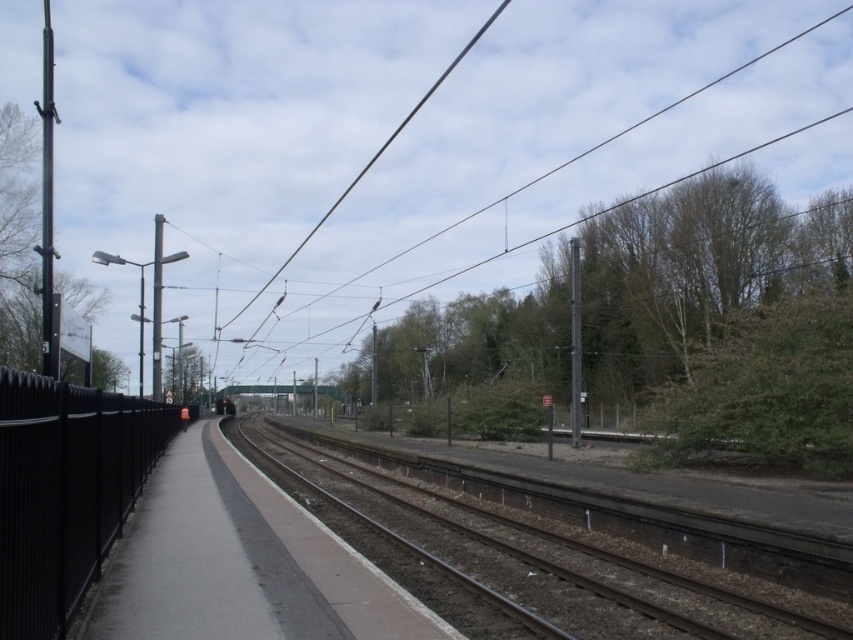
Is concrete platform at center smaller than black wire at upper center?

Indeed, concrete platform at center has a smaller size compared to black wire at upper center.

I want to click on concrete platform at center, so click(241, 563).

Who is more distant from viewer, (x=273, y=625) or (x=111, y=426)?

The point (x=111, y=426) is more distant.

Who is more forward, (x=215, y=579) or (x=71, y=518)?

Point (x=71, y=518) is more forward.

Find the location of `concrete platform at center`. concrete platform at center is located at coordinates [x=241, y=563].

Can you confirm if black metal fence at left is wider than black wire at upper center?

Incorrect, black metal fence at left's width does not surpass black wire at upper center's.

Consider the image. Does black metal fence at left have a lesser height compared to black wire at upper center?

Indeed, black metal fence at left has a lesser height compared to black wire at upper center.

Does point (122, 497) lie in front of point (699, 90)?

Yes.

At what (x,y) coordinates should I click in order to perform the action: click on black metal fence at left. Please return your answer as a coordinate pair (x, y). The height and width of the screenshot is (640, 853). Looking at the image, I should click on (65, 492).